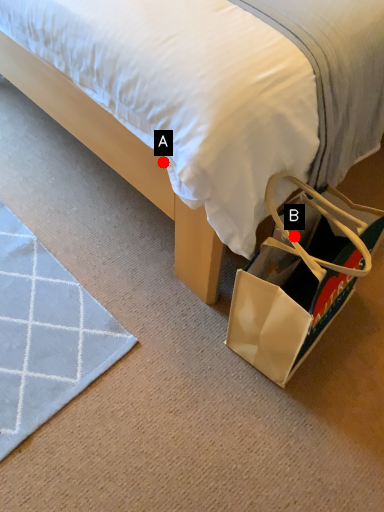
Question: Two points are circled on the image, labeled by A and B beside each circle. Which point is farther from the camera taking this photo?

Choices:
 (A) A is further
 (B) B is further

Answer: (B)